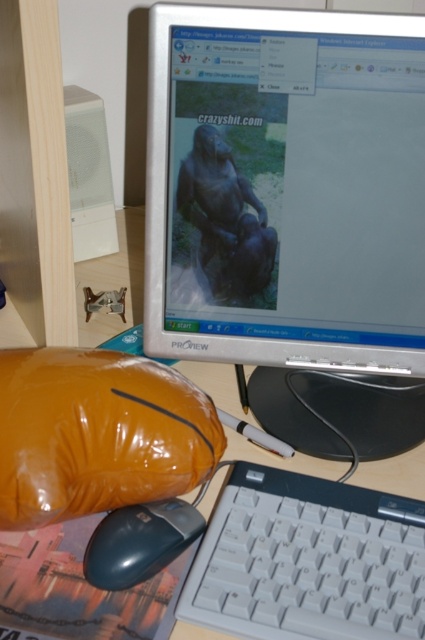
Can you confirm if orange fabric pillow at lower left is bigger than matte black mouse at lower left?

Correct, orange fabric pillow at lower left is larger in size than matte black mouse at lower left.

Can you confirm if orange fabric pillow at lower left is shorter than matte black mouse at lower left?

Incorrect, orange fabric pillow at lower left's height does not fall short of matte black mouse at lower left's.

Between point (156, 436) and point (96, 532), which one is positioned in front?

Point (156, 436)

Where is `orange fabric pillow at lower left`? The image size is (425, 640). orange fabric pillow at lower left is located at coordinates coord(96,433).

Is point (353, 604) positioned in front of point (175, 632)?

Yes, point (353, 604) is in front of point (175, 632).

In the scene shown: Which is below, white plastic keyboard at lower center or white plastic computer desk at lower center?

white plastic keyboard at lower center

Between point (212, 554) and point (175, 630), which one is positioned behind?

Point (212, 554)

This screenshot has height=640, width=425. In order to click on white plastic keyboard at lower center in this screenshot , I will do `click(308, 561)`.

Is matte plastic monitor at center wider than white plastic keyboard at lower center?

Yes.

Is matte plastic monitor at center shorter than white plastic keyboard at lower center?

Incorrect, matte plastic monitor at center's height does not fall short of white plastic keyboard at lower center's.

Where is `matte plastic monitor at center`? Image resolution: width=425 pixels, height=640 pixels. matte plastic monitor at center is located at coordinates 286,188.

Image resolution: width=425 pixels, height=640 pixels. I want to click on matte plastic monitor at center, so [x=286, y=188].